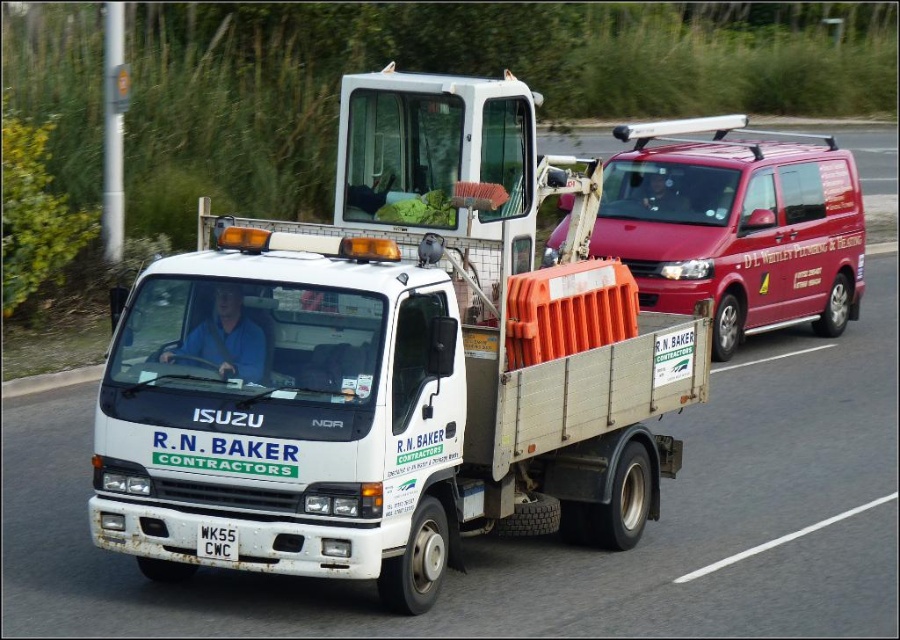
Based on the photo, is white matte truck at center further to camera compared to white plastic license plate at lower center?

No, it is in front of white plastic license plate at lower center.

Does white matte truck at center have a lesser width compared to white plastic license plate at lower center?

No.

Which is behind, point (432, 426) or point (212, 545)?

Point (432, 426)

Locate an element on the screen. The image size is (900, 640). white matte truck at center is located at coordinates (392, 362).

Between white matte truck at center and metallic red van at right, which one has less height?

With less height is white matte truck at center.

Is white matte truck at center above metallic red van at right?

No, white matte truck at center is not above metallic red van at right.

Is point (446, 157) behind point (690, 144)?

That is False.

Where is `white matte truck at center`? white matte truck at center is located at coordinates (392, 362).

How far apart are metallic red van at right and white plastic license plate at lower center?

A distance of 7.30 meters exists between metallic red van at right and white plastic license plate at lower center.

Measure the distance between point [633,209] and camera.

Point [633,209] is 15.02 meters from camera.

At what (x,y) coordinates should I click in order to perform the action: click on metallic red van at right. Please return your answer as a coordinate pair (x, y). This screenshot has height=640, width=900. Looking at the image, I should click on (735, 227).

The width and height of the screenshot is (900, 640). Find the location of `metallic red van at right`. metallic red van at right is located at coordinates (735, 227).